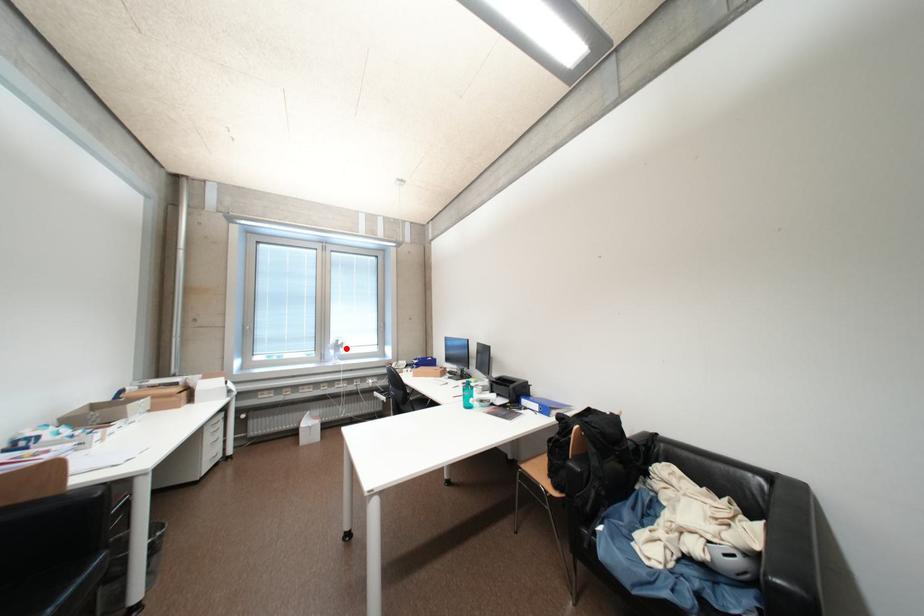
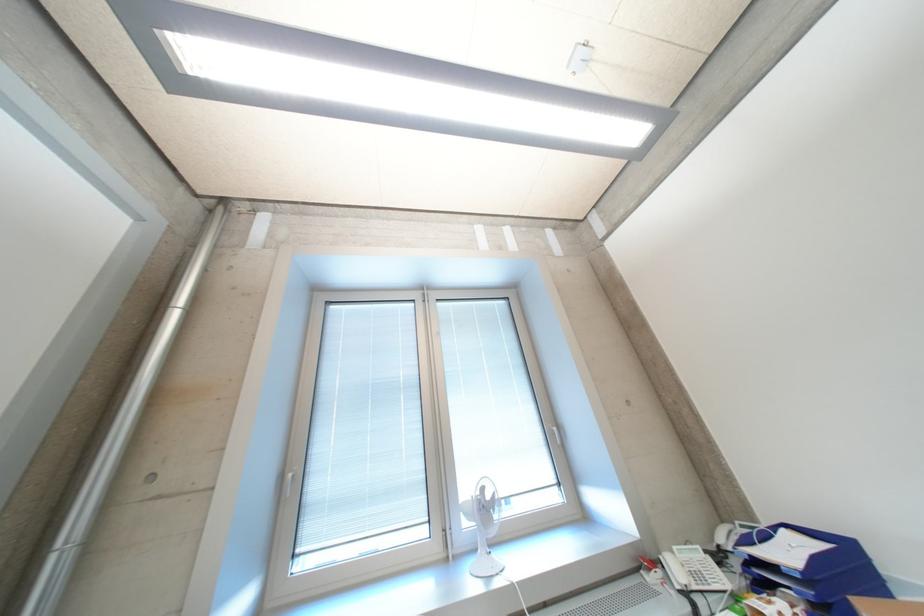
Locate, in the second image, the point that corresponds to the highlighted location in the first image.

(492, 509)